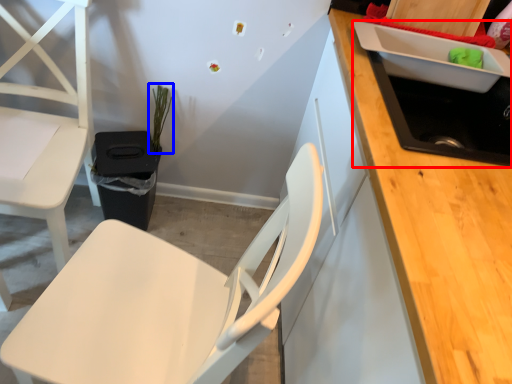
Question: Among these objects, which one is farthest to the camera, sink (highlighted by a red box) or plant (highlighted by a blue box)?

Choices:
 (A) sink
 (B) plant

Answer: (B)